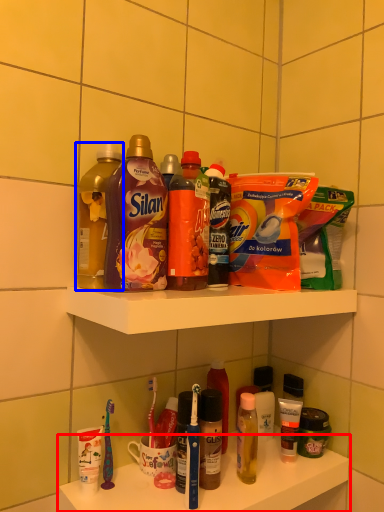
Question: Which of the following is the closest to the observer, supermarket shelf (highlighted by a red box) or bottle (highlighted by a blue box)?

Choices:
 (A) supermarket shelf
 (B) bottle

Answer: (A)